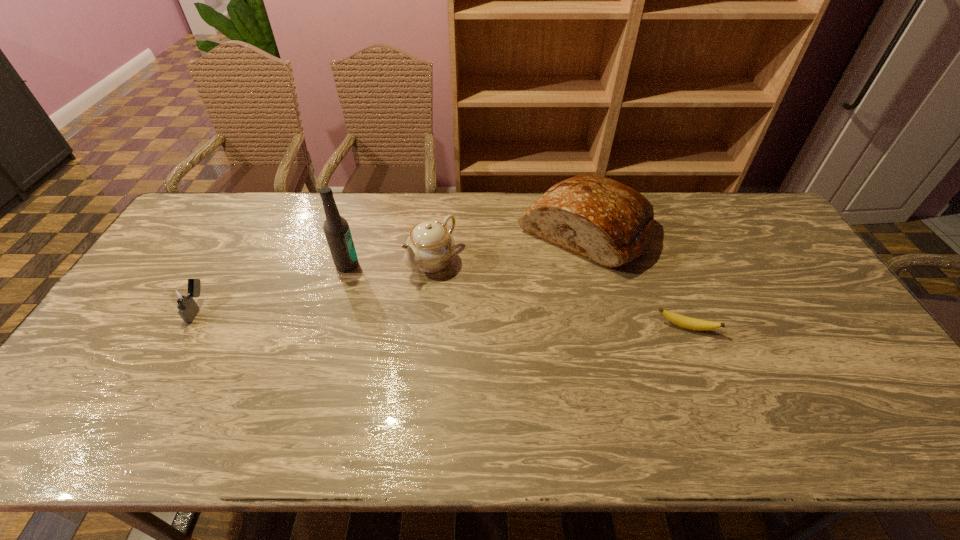
This screenshot has width=960, height=540. What are the coordinates of `vacant space situated 0.270m at the sliced front of the fourth shortest object` in the screenshot? It's located at (488, 314).

This screenshot has width=960, height=540. I want to click on vacant region located 0.070m at the sliced front of the fourth shortest object, so click(x=531, y=275).

Locate an element on the screen. The height and width of the screenshot is (540, 960). blank space located 0.400m at the sliced front of the fourth shortest object is located at coordinates [455, 342].

Locate an element on the screen. vacant space located 0.290m at the spout of the chinaware is located at coordinates (340, 340).

At what (x,y) coordinates should I click in order to perform the action: click on vacant space located at the spout of the chinaware. Please return your answer as a coordinate pair (x, y). Looking at the image, I should click on (394, 295).

This screenshot has width=960, height=540. Identify the location of free region located 0.240m at the spout of the chinaware. (354, 328).

You are a GUI agent. You are given a task and a screenshot of the screen. Output one action in this format:
    pyautogui.click(x=<x>, y=<y>)
    Task: Click on the vacant space positioned on the side of the beer bottle with the label
    The width and height of the screenshot is (960, 540).
    Given the screenshot: What is the action you would take?
    pyautogui.click(x=418, y=309)

Find the location of `vacant space situated on the side of the beer bottle with the label`. vacant space situated on the side of the beer bottle with the label is located at coordinates (367, 277).

This screenshot has width=960, height=540. I want to click on free space located 0.350m on the side of the beer bottle with the label, so click(443, 325).

Identify the location of object that is at the far edge. The width and height of the screenshot is (960, 540). (610, 223).